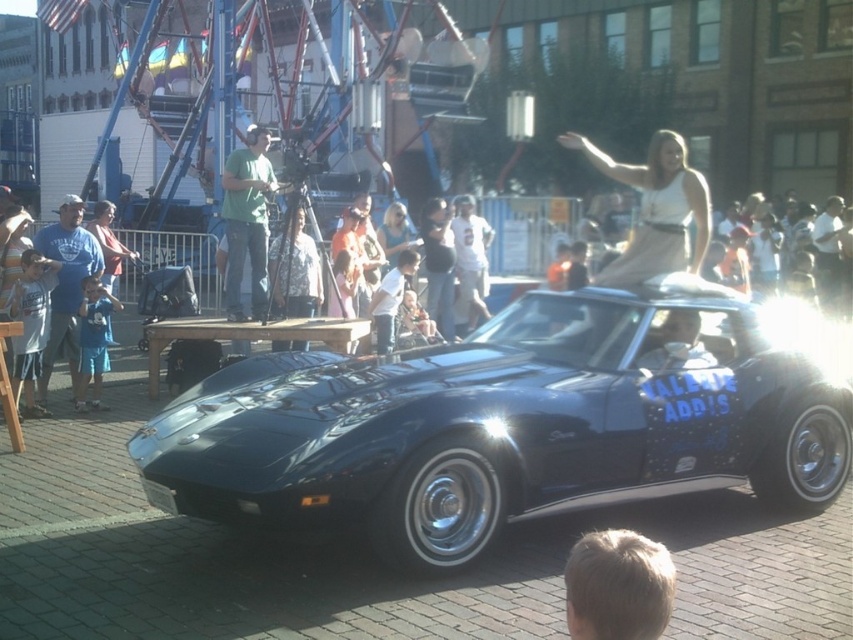
You are standing at the point labeled point (97,408) and want to walk to the point labeled point (254,257). Which direction should you face to walk towards your destination?

You should face towards the north direction to walk from point (97,408) to point (254,257) because point (254,257) is behind point (97,408).

Based on the photo, you are a photographer trying to capture both the glossy black car at center and the blue cotton shirt at lower left in the same frame. Considering their sizes, which object should you focus on first to ensure both are in the frame?

The glossy black car at center is taller than the blue cotton shirt at lower left, so you should focus on the glossy black car at center first to ensure both fit in the frame.